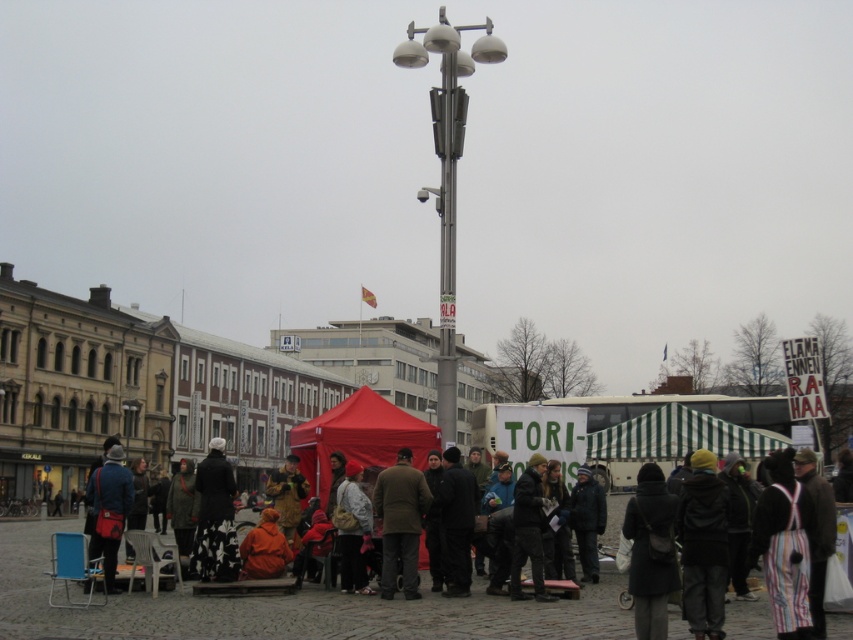
You are a photographer trying to capture a photo of the orange fabric jacket at lower center without the metallic gray pole at center blocking it. Based on their heights, is this possible?

The metallic gray pole at center is taller than the orange fabric jacket at lower center, so it is possible to angle the camera so that the pole does not block the jacket by positioning the camera lower or moving to a side where the pole is not directly in front.

You are a street performer planning to set up a small stage between the metallic gray pole at center and the orange fabric jacket at lower center. Considering their widths, which object might require more space to accommodate the stage setup?

The orange fabric jacket at lower center requires more space because it has a greater width than the metallic gray pole at center.